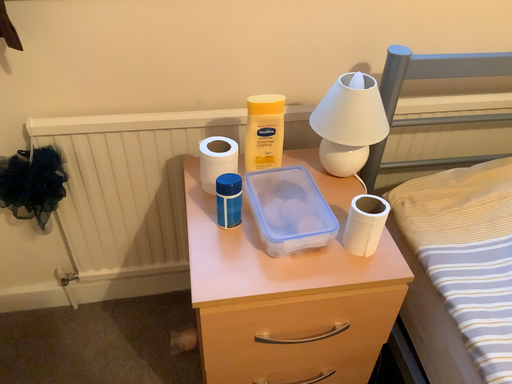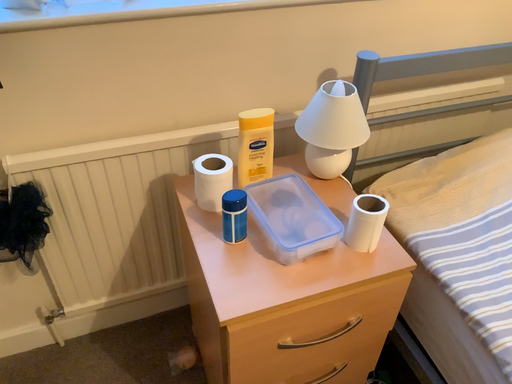
Question: Which way did the camera rotate in the video?

Choices:
 (A) rotated left
 (B) rotated right

Answer: (B)